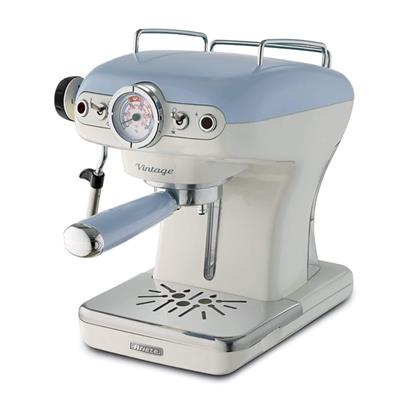
Locate an element on the screen. The width and height of the screenshot is (416, 416). vintage style coffee machine is located at coordinates pos(267,208).